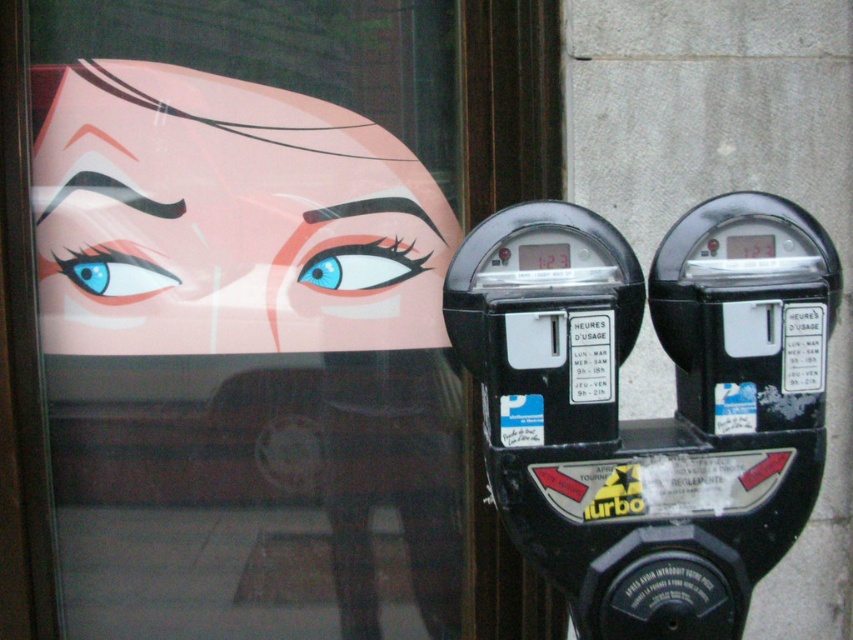
Question: Estimate the real-world distances between objects in this image. Which object is closer to the matte plastic face at upper left?

Choices:
 (A) matte blue eye at upper left
 (B) transparent glass at upper left
 (C) black plastic parking meter at right

Answer: (B)

Question: Is black plastic parking meter at right above blue glossy eye at center?

Choices:
 (A) yes
 (B) no

Answer: (B)

Question: Does transparent glass at upper left have a smaller size compared to matte blue eye at upper left?

Choices:
 (A) no
 (B) yes

Answer: (A)

Question: Which point appears farthest from the camera in this image?

Choices:
 (A) (231, 204)
 (B) (82, 253)
 (C) (480, 340)

Answer: (B)

Question: Observing the image, what is the correct spatial positioning of transparent glass at upper left in reference to matte plastic face at upper left?

Choices:
 (A) below
 (B) above

Answer: (A)

Question: Among these points, which one is nearest to the camera?

Choices:
 (A) (410, 337)
 (B) (90, 266)

Answer: (B)